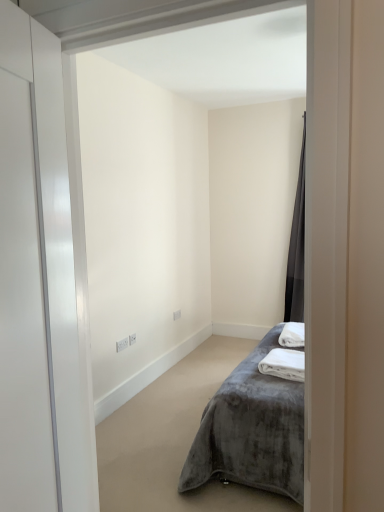
Question: Is velvet grey bed at center next to dark gray velvet curtain at right?

Choices:
 (A) no
 (B) yes

Answer: (A)

Question: Is velvet grey bed at center shorter than dark gray velvet curtain at right?

Choices:
 (A) no
 (B) yes

Answer: (B)

Question: Is velvet grey bed at center further to the viewer compared to dark gray velvet curtain at right?

Choices:
 (A) no
 (B) yes

Answer: (A)

Question: From the image's perspective, is velvet grey bed at center on dark gray velvet curtain at right?

Choices:
 (A) yes
 (B) no

Answer: (B)

Question: Could you tell me if velvet grey bed at center is turned towards dark gray velvet curtain at right?

Choices:
 (A) no
 (B) yes

Answer: (A)

Question: Considering the relative positions of velvet grey bed at center and dark gray velvet curtain at right in the image provided, is velvet grey bed at center to the right of dark gray velvet curtain at right from the viewer's perspective?

Choices:
 (A) no
 (B) yes

Answer: (A)

Question: Could you tell me if velvet grey bed at center is facing white glossy door at left?

Choices:
 (A) no
 (B) yes

Answer: (A)

Question: From a real-world perspective, is velvet grey bed at center on top of white glossy door at left?

Choices:
 (A) no
 (B) yes

Answer: (A)

Question: Does velvet grey bed at center appear on the left side of white glossy door at left?

Choices:
 (A) yes
 (B) no

Answer: (B)

Question: Is velvet grey bed at center smaller than white glossy door at left?

Choices:
 (A) yes
 (B) no

Answer: (B)

Question: Would you say velvet grey bed at center contains white glossy door at left?

Choices:
 (A) no
 (B) yes

Answer: (A)

Question: Is the position of velvet grey bed at center less distant than that of white glossy door at left?

Choices:
 (A) no
 (B) yes

Answer: (A)

Question: Is dark gray velvet curtain at right positioned far away from velvet grey bed at center?

Choices:
 (A) yes
 (B) no

Answer: (A)